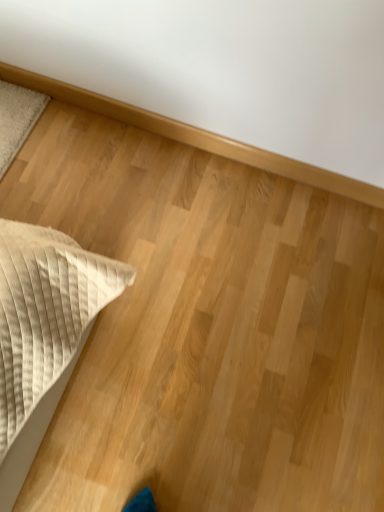
The width and height of the screenshot is (384, 512). I want to click on free space to the left of natural wood baseboard at upper center, so click(91, 152).